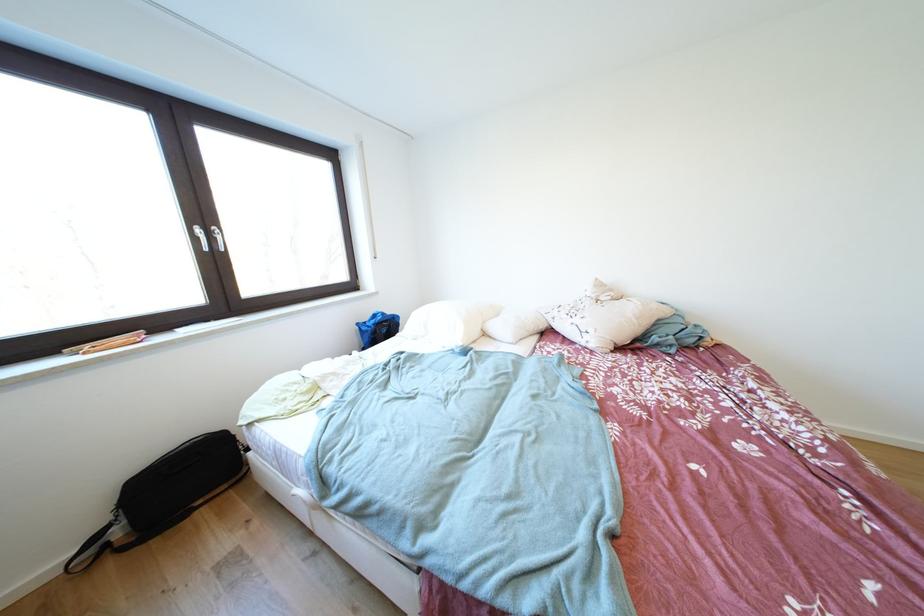
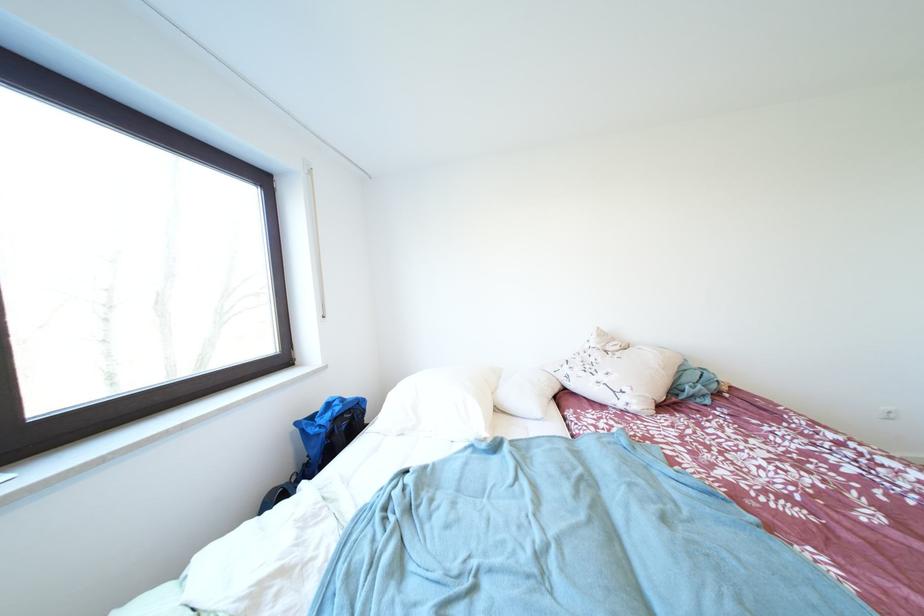
The point at (x=367, y=329) is marked in the first image. Where is the corresponding point in the second image?

(305, 428)